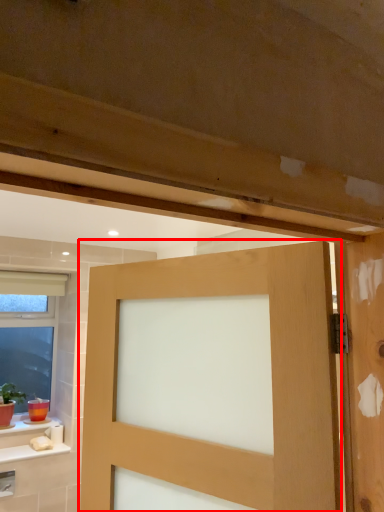
Question: From the image's perspective, considering the relative positions of door (annotated by the red box) and window in the image provided, where is door (annotated by the red box) located with respect to the staircase?

Choices:
 (A) above
 (B) below

Answer: (A)